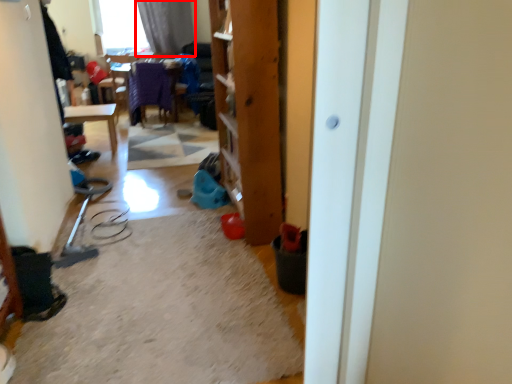
Question: From the image's perspective, considering the relative positions of curtain (annotated by the red box) and screen door in the image provided, where is curtain (annotated by the red box) located with respect to the staircase?

Choices:
 (A) above
 (B) below

Answer: (A)